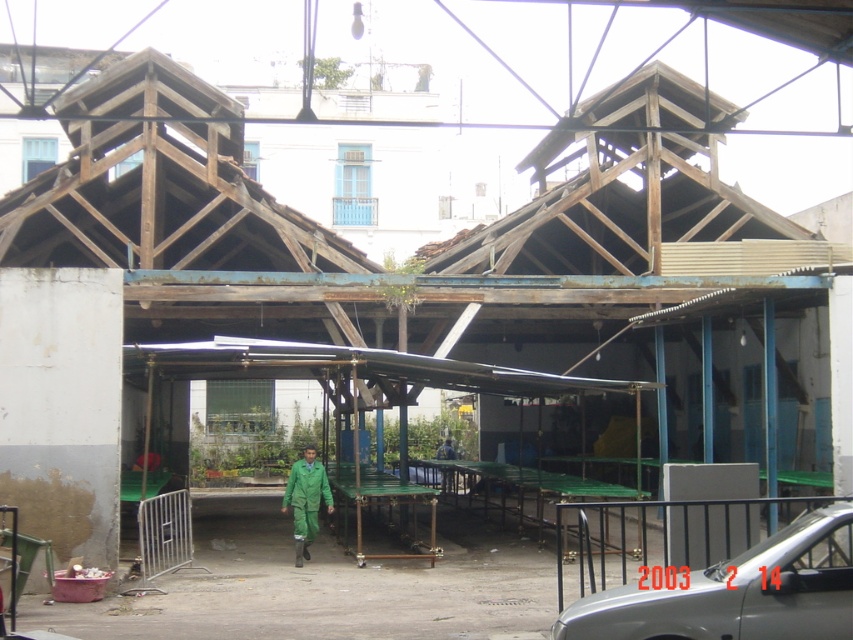
Question: Which point is closer to the camera taking this photo?

Choices:
 (A) (685, 561)
 (B) (309, 499)

Answer: (A)

Question: Considering the relative positions of silver metallic car at lower right and green matte jumpsuit at center in the image provided, where is silver metallic car at lower right located with respect to green matte jumpsuit at center?

Choices:
 (A) below
 (B) above

Answer: (B)

Question: Observing the image, what is the correct spatial positioning of silver metallic car at lower right in reference to green matte jumpsuit at center?

Choices:
 (A) below
 (B) above

Answer: (B)

Question: Which of the following is the closest to the observer?

Choices:
 (A) click(585, 532)
 (B) click(328, 508)

Answer: (A)

Question: Is silver metallic car at lower right to the left of green matte jumpsuit at center from the viewer's perspective?

Choices:
 (A) no
 (B) yes

Answer: (A)